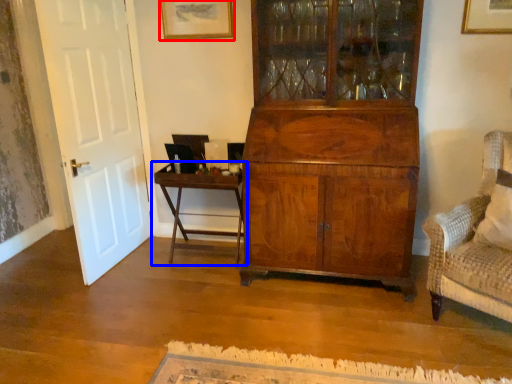
Question: Which object appears farthest to the camera in this image, picture frame (highlighted by a red box) or table (highlighted by a blue box)?

Choices:
 (A) picture frame
 (B) table

Answer: (A)